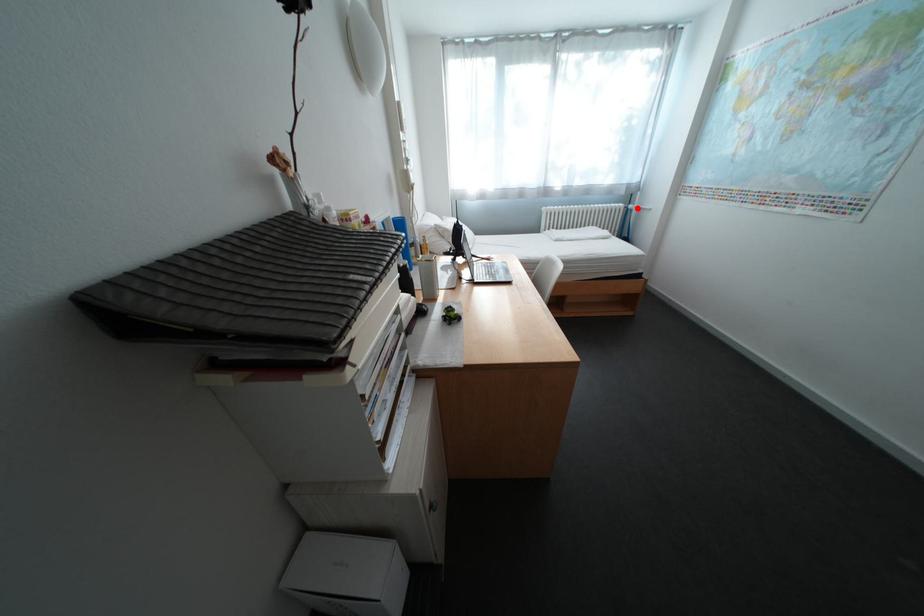
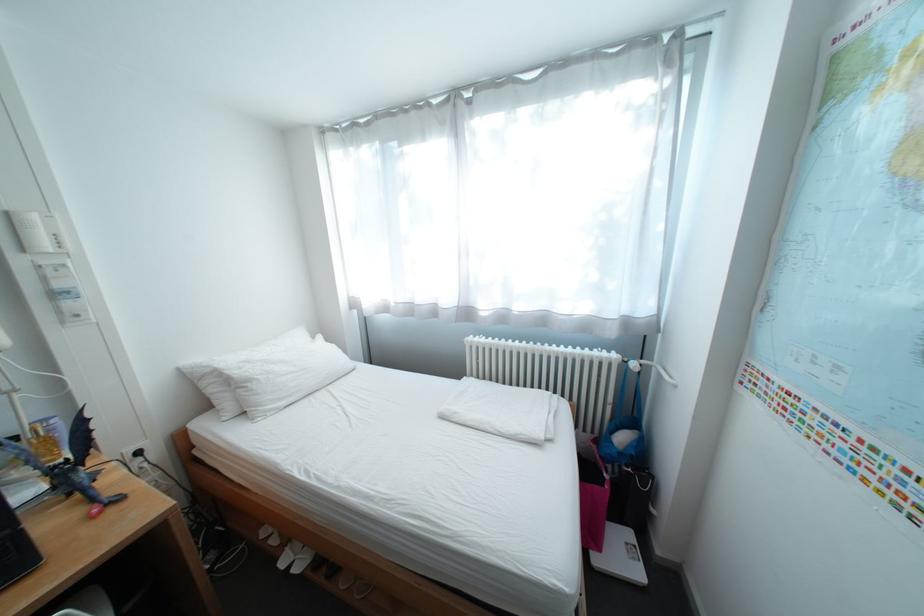
The point at the highlighted location is marked in the first image. Where is the corresponding point in the second image?

(637, 362)